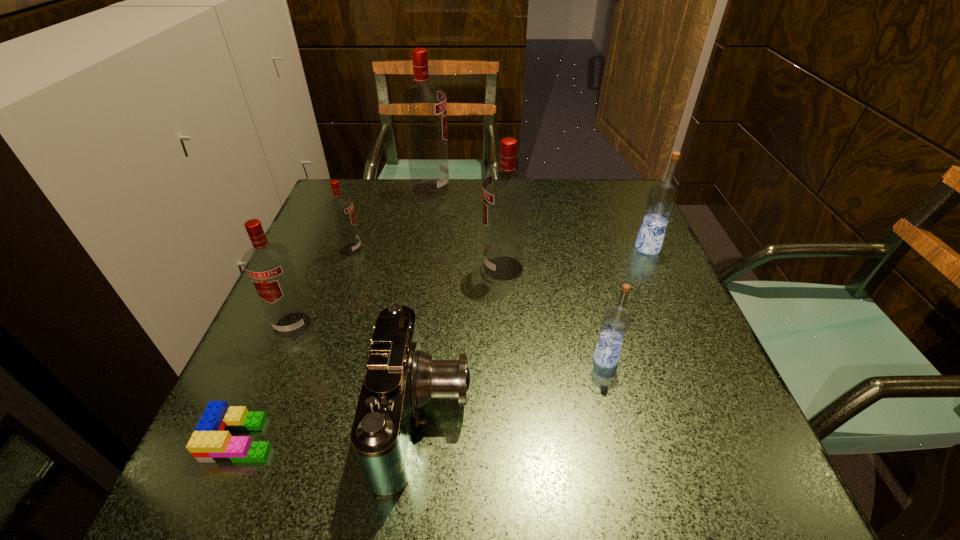
Locate an element on the screen. The image size is (960, 540). the nearest vodka is located at coordinates (616, 320).

Locate an element on the screen. The width and height of the screenshot is (960, 540). camcorder is located at coordinates (400, 379).

Locate an element on the screen. This screenshot has width=960, height=540. blue camcorder is located at coordinates (400, 379).

You are a GUI agent. You are given a task and a screenshot of the screen. Output one action in this format:
    pyautogui.click(x=<x>, y=<y>)
    Task: Click on the green Lego
    This screenshot has height=540, width=960.
    Given the screenshot: What is the action you would take?
    pyautogui.click(x=211, y=441)

The width and height of the screenshot is (960, 540). Identify the location of the shortest object. (211, 441).

The image size is (960, 540). What are the coordinates of `free space located 0.170m on the front label of the farthest object` in the screenshot? It's located at (512, 189).

Locate an element on the screen. Image resolution: width=960 pixels, height=540 pixels. vacant space positioned 0.260m on the front label of the fifth shortest vodka is located at coordinates (365, 268).

Image resolution: width=960 pixels, height=540 pixels. Find the location of `vacant position located 0.340m on the front label of the fifth shortest vodka`. vacant position located 0.340m on the front label of the fifth shortest vodka is located at coordinates (328, 268).

The width and height of the screenshot is (960, 540). I want to click on vacant area situated 0.240m on the front label of the fifth shortest vodka, so click(373, 268).

The image size is (960, 540). I want to click on vacant position located on the left of the rightmost vodka, so click(532, 248).